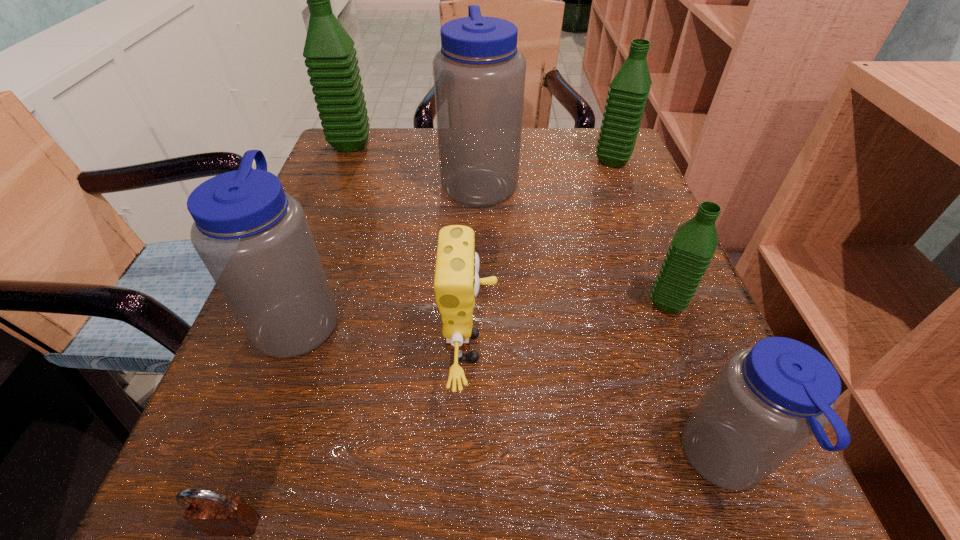
This screenshot has width=960, height=540. I want to click on brown padlock, so [x=216, y=514].

Where is `the shortest object`? Image resolution: width=960 pixels, height=540 pixels. the shortest object is located at coordinates (216, 514).

You are a GUI agent. You are given a task and a screenshot of the screen. Output one action in this format:
    pyautogui.click(x=<x>, y=<y>)
    Task: Click on the vacant space positioned on the right of the biggest green water bottle
    This screenshot has height=540, width=960.
    Given the screenshot: What is the action you would take?
    pyautogui.click(x=491, y=145)

Locate an element on the screen. This screenshot has height=540, width=960. free space located with a carrying loop on the side of the biggest blue water bottle is located at coordinates (591, 182).

This screenshot has height=540, width=960. In order to click on vacant space located 0.180m on the left of the second biggest green water bottle in this screenshot , I will do `click(509, 160)`.

Identify the location of vacant region located 0.180m with a carrying loop on the side of the second smallest blue water bottle. (464, 318).

Where is `vacant space positioned on the face of the sponge`? The image size is (960, 540). vacant space positioned on the face of the sponge is located at coordinates (552, 348).

Identify the location of vacant region located on the front of the smallest green water bottle. (724, 447).

The image size is (960, 540). I want to click on vacant space located with a carrying loop on the side of the nearest blue water bottle, so click(x=483, y=462).

Locate an element on the screen. Image resolution: width=960 pixels, height=540 pixels. free space located with a carrying loop on the side of the nearest blue water bottle is located at coordinates (343, 462).